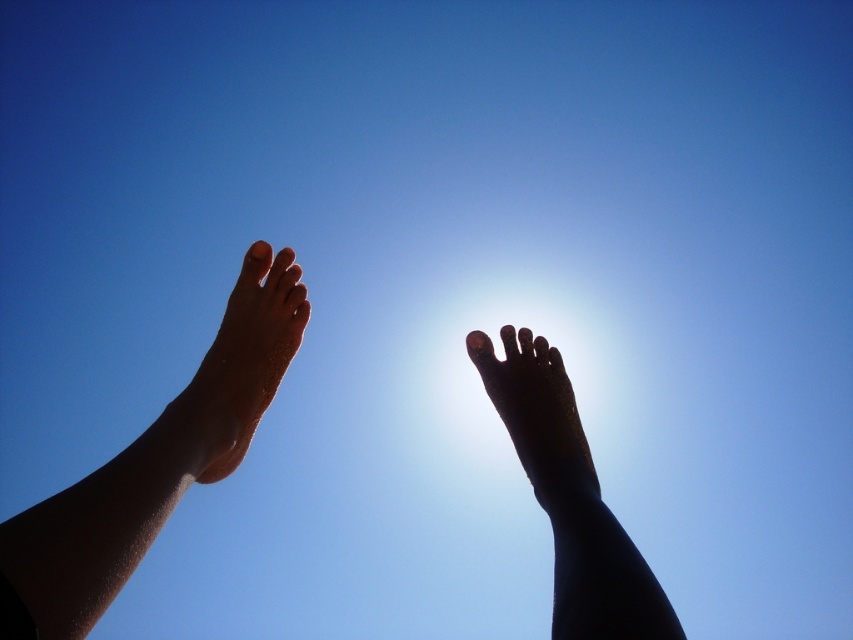
You are standing on a beach and see the sun between two black matte feet. Which foot is the point at coordinate point (570, 497) located on?

The point at coordinate point (570, 497) is located on the black matte foot at upper center.

You are standing on a beach and see the point marked at coordinates (154, 465). What object is located at that point?

The sandy feet at center is located at the point marked at coordinates (154, 465).

You are a photographer trying to capture the perfect silhouette of both the sandy feet at center and the black matte foot at center. Since the sun is between them, which foot will cast a darker shadow?

The sandy feet at center is larger in size than black matte foot at center, so the sandy feet at center will cast a darker shadow because larger objects typically cast darker shadows when the light source is between them.